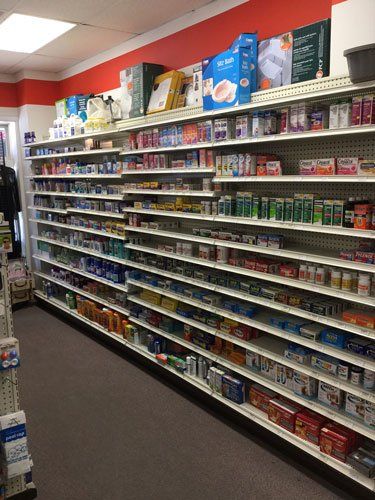
Locate an element on the screen. This screenshot has width=375, height=500. red decorative painted band on wall is located at coordinates coord(111,68).